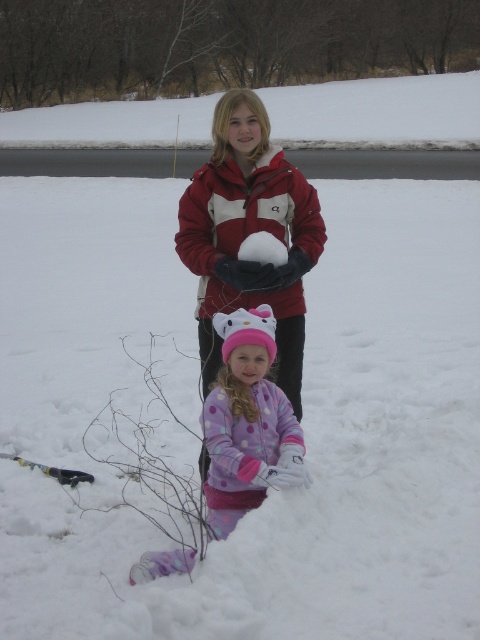
Question: Which object is closer to the camera taking this photo?

Choices:
 (A) purple polka dot snowsuit at center
 (B) white fluffy snowball at center
 (C) yellow and black ski at lower left

Answer: (A)

Question: Does purple polka dot snowsuit at center have a smaller size compared to white fluffy snowball at center?

Choices:
 (A) yes
 (B) no

Answer: (B)

Question: Considering the relative positions of matte red jacket at center and yellow and black ski at lower left in the image provided, where is matte red jacket at center located with respect to yellow and black ski at lower left?

Choices:
 (A) below
 (B) above

Answer: (B)

Question: Which point appears farthest from the camera in this image?

Choices:
 (A) (243, 157)
 (B) (255, 502)
 (C) (259, 237)

Answer: (A)

Question: Which point is farther from the camera taking this photo?

Choices:
 (A) (276, 410)
 (B) (307, 209)
 (C) (273, 237)

Answer: (B)

Question: Does white fluffy snowball at center appear on the left side of yellow and black ski at lower left?

Choices:
 (A) no
 (B) yes

Answer: (A)